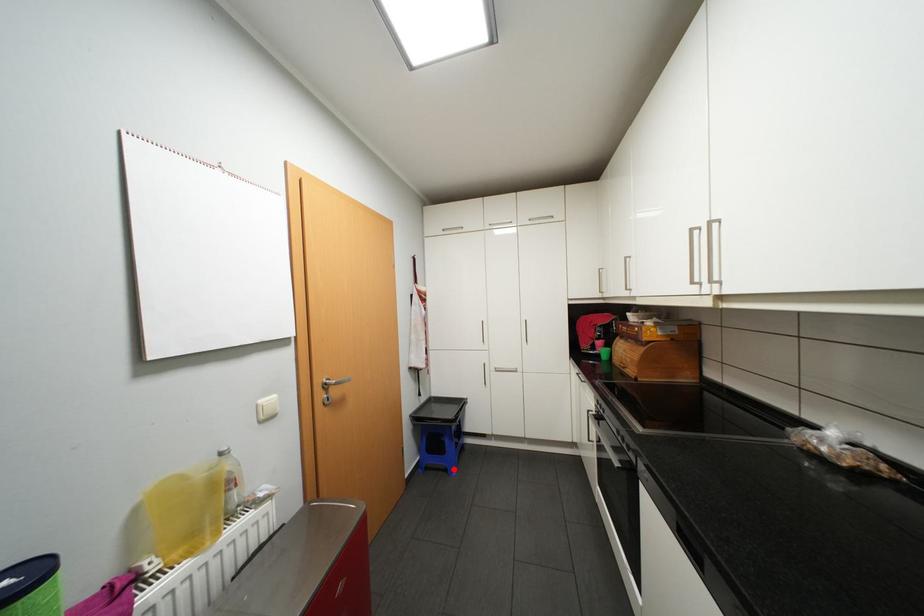
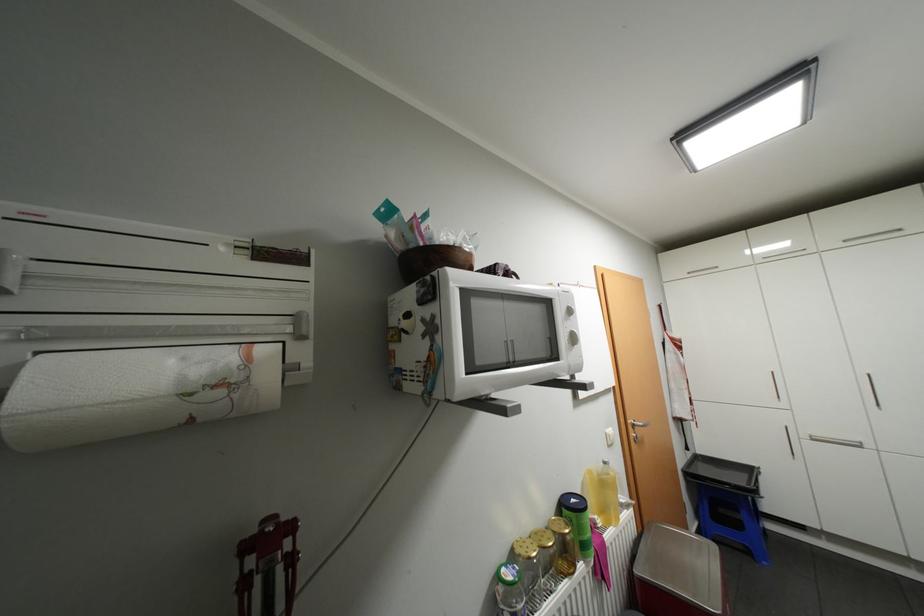
Question: I am providing you with two images of the same scene from different viewpoints. A red point is shown in image1. For the corresponding object point in image2, is it positioned nearer or farther from the camera?

Choices:
 (A) Nearer
 (B) Farther

Answer: (A)